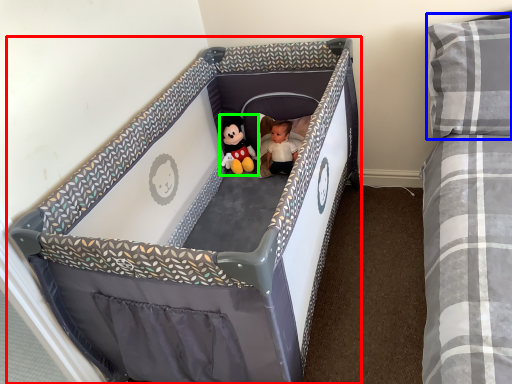
Question: Estimate the real-world distances between objects in this image. Which object is closer to infant bed (highlighted by a red box), pillow (highlighted by a blue box) or toy (highlighted by a green box)?

Choices:
 (A) pillow
 (B) toy

Answer: (B)